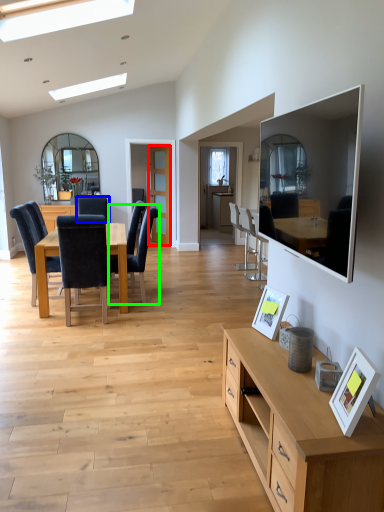
Question: Which object is positioned farthest from glass door (highlighted by a red box)? Select from chair (highlighted by a blue box) and chair (highlighted by a green box).

Choices:
 (A) chair
 (B) chair

Answer: (B)